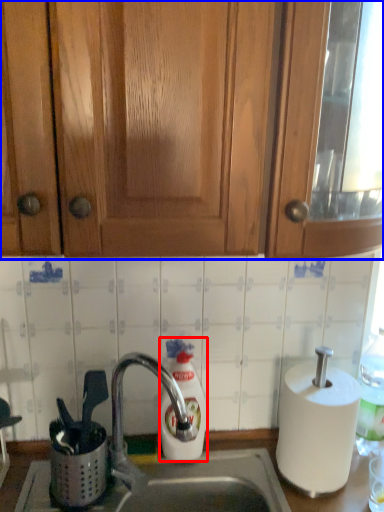
Question: Which point is closer to the camera, soap dispenser (highlighted by a red box) or cabinetry (highlighted by a blue box)?

Choices:
 (A) soap dispenser
 (B) cabinetry

Answer: (B)